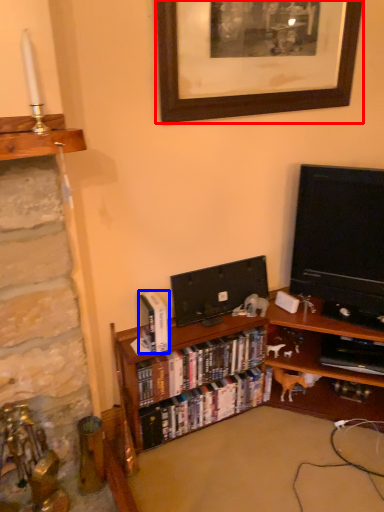
Question: Which object is closer to the camera taking this photo, picture frame (highlighted by a red box) or book (highlighted by a blue box)?

Choices:
 (A) picture frame
 (B) book

Answer: (A)